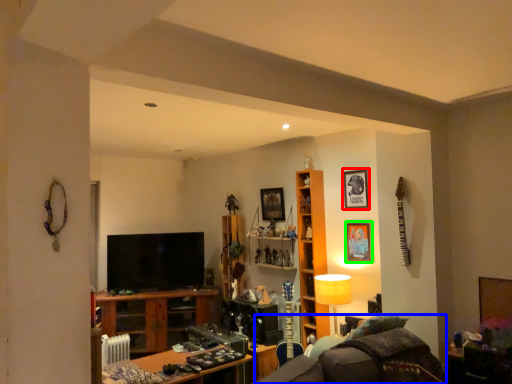
Question: Estimate the real-world distances between objects in this image. Which object is farther from picture frame (highlighted by a red box), swivel chair (highlighted by a blue box) or picture frame (highlighted by a green box)?

Choices:
 (A) swivel chair
 (B) picture frame

Answer: (A)